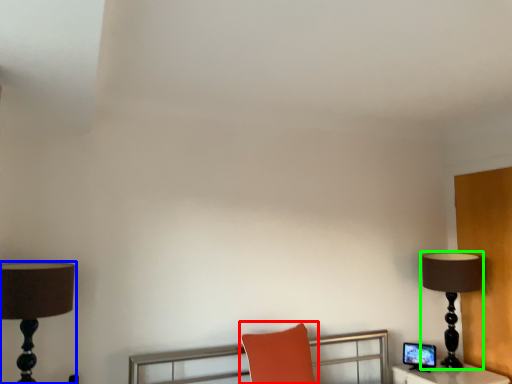
Question: Estimate the real-world distances between objects in this image. Which object is closer to swivel chair (highlighted by a red box), lamp (highlighted by a blue box) or lamp (highlighted by a green box)?

Choices:
 (A) lamp
 (B) lamp

Answer: (B)